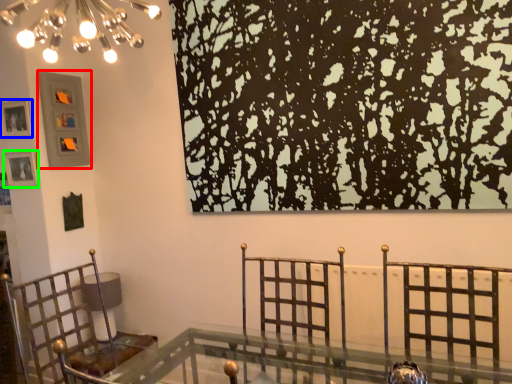
Question: Estimate the real-world distances between objects in this image. Which object is closer to picture frame (highlighted by a red box), picture frame (highlighted by a blue box) or picture frame (highlighted by a green box)?

Choices:
 (A) picture frame
 (B) picture frame

Answer: (A)